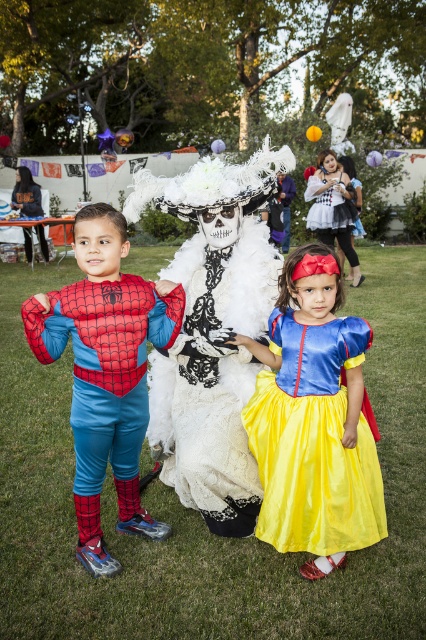
You are a photographer at a Halloween party and need to position two guests wearing the white lace dress at center and the matte white dress at center. According to the scene, which dress is positioned to the left?

The white lace dress at center is to the left of the matte white dress at center.

You are taking a photo of the Spiderman costume and want to focus on the points labeled as point (111, 397) and point (333, 177). Which point should you focus on first to ensure the closer one is sharp?

Point (111, 397) is closer to the camera than point (333, 177), so you should focus on point (111, 397) first to ensure the closer one is sharp.